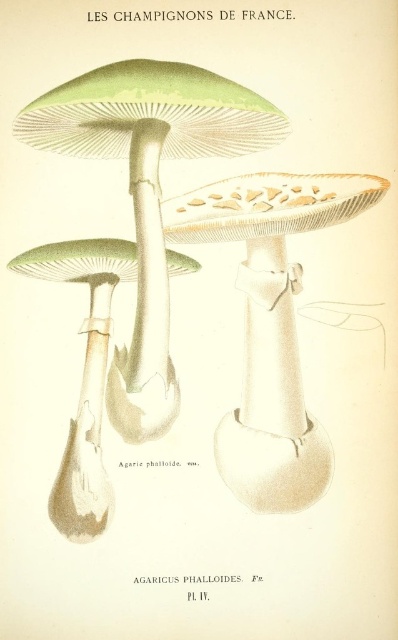
From the picture: You are a mycologist examining the illustration of Agaricus phalloides. You notice a point marked at coordinates (148, 189). What does this point indicate?

The point at (148, 189) indicates the green matte agaricus phalloides at center.

Based on the illustration from the book, which mushroom is closer to the viewer between the green matte agaricus phalloides at center and the smooth beige mushroom at center?

The green matte agaricus phalloides at center is closer to the viewer as it is positioned in front of the smooth beige mushroom at center.